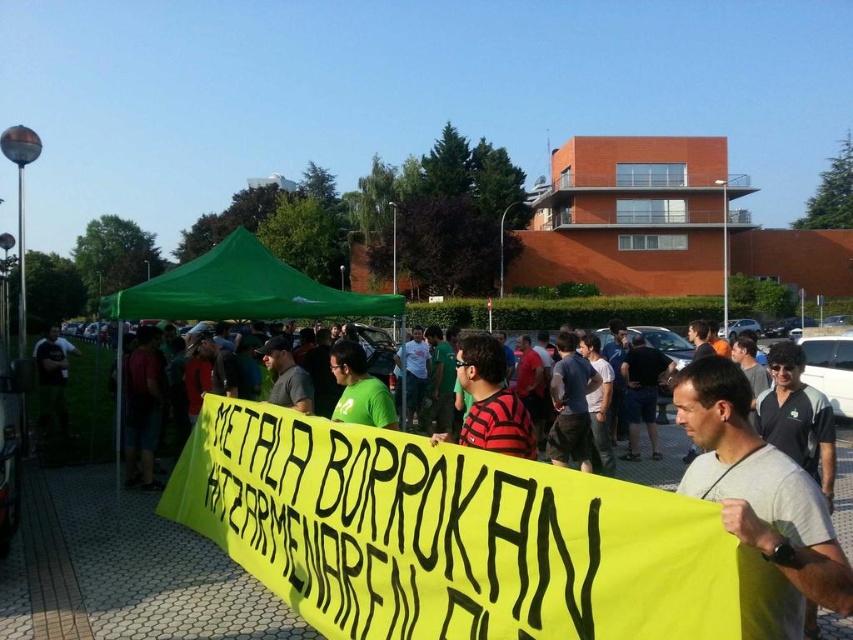
You are a photographer at the event. You want to take a photo of the striped cotton shirt at center without the green fabric canopy at center blocking the view. Where should you position yourself relative to the shirt?

The green fabric canopy at center is above the striped cotton shirt at center, so to avoid the canopy blocking the view, you should position yourself below the shirt, facing upwards.

You are standing in the crowd at the gathering. You want to take a photo of the green fabric canopy at center without the gray fabric at center blocking it. How should you position yourself?

Move behind the gray fabric at center so that it is between you and the green fabric canopy at center. Since the gray fabric at center is closer to the viewer, moving behind it would allow you to see the green fabric canopy at center without obstruction.

You are at an outdoor event and want to find shade. You see a gray fabric at center and a green fabric canopy at center. Which one is providing shade?

The green fabric canopy at center is providing shade because it is above the gray fabric at center, which is located below it.